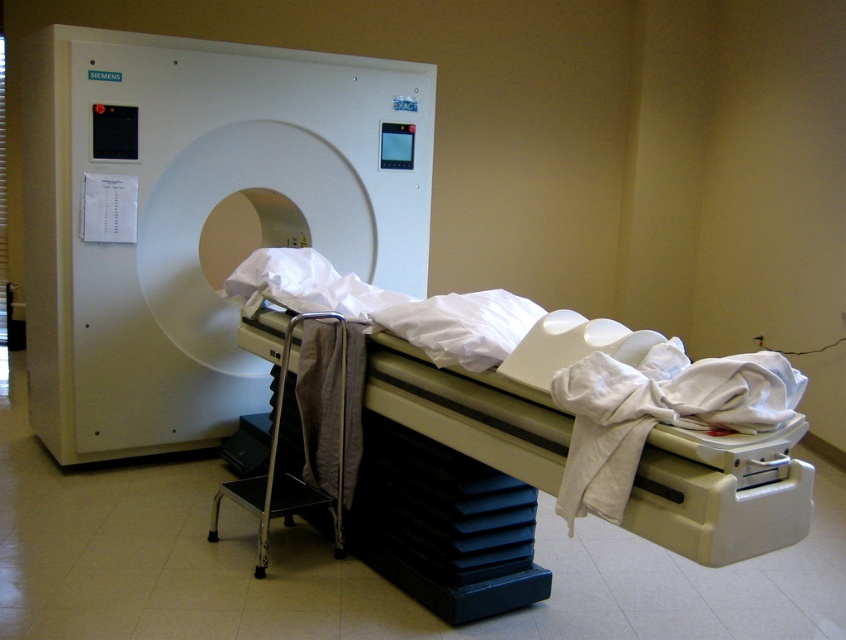
Question: Among these points, which one is farthest from the camera?

Choices:
 (A) (698, 400)
 (B) (649, 467)

Answer: (A)

Question: Can you confirm if white fabric bed at center is positioned to the left of white matte cloth at lower right?

Choices:
 (A) yes
 (B) no

Answer: (A)

Question: Observing the image, what is the correct spatial positioning of white fabric bed at center in reference to white matte cloth at lower right?

Choices:
 (A) above
 (B) below

Answer: (B)

Question: Does white fabric bed at center have a smaller size compared to white matte cloth at lower right?

Choices:
 (A) no
 (B) yes

Answer: (A)

Question: Among these objects, which one is farthest from the camera?

Choices:
 (A) white fabric bed at center
 (B) white matte cloth at lower right

Answer: (B)